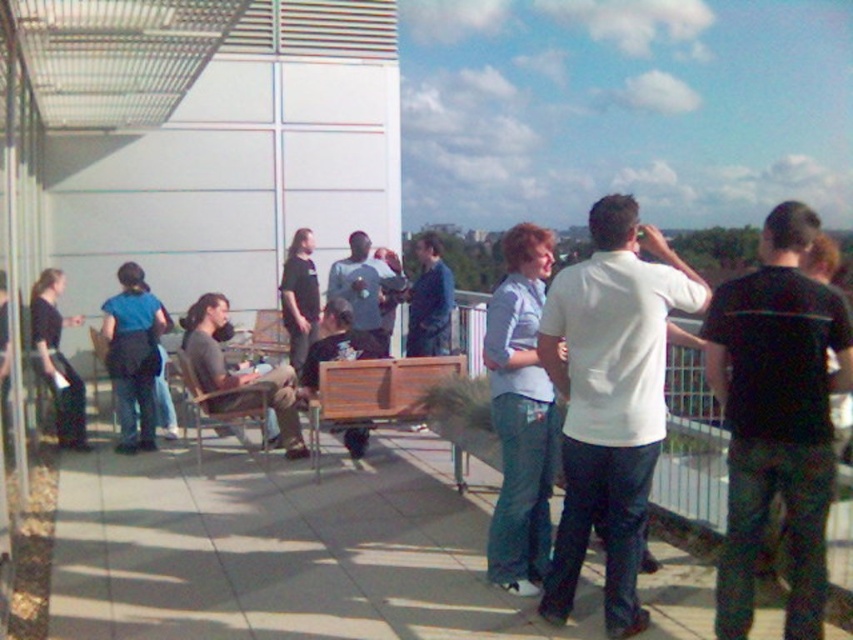
Question: Is white matte shirt at center smaller than brown wooden bench at center?

Choices:
 (A) yes
 (B) no

Answer: (A)

Question: Estimate the real-world distances between objects in this image. Which object is farther from the white matte shirt at center?

Choices:
 (A) wooden bench at center
 (B) blue denim jacket at center
 (C) gray fabric shirt at center

Answer: (B)

Question: Which point is farther to the camera?

Choices:
 (A) (440, 317)
 (B) (260, 397)
 (C) (381, 269)
 (D) (822, 547)

Answer: (C)

Question: Which object is positioned farthest from the wooden bench at center?

Choices:
 (A) white matte shirt at center
 (B) black cotton shirt at right
 (C) blue denim jacket at center
 (D) brown wooden bench at center

Answer: (B)

Question: Does black cotton shirt at right appear under blue denim jacket at center?

Choices:
 (A) yes
 (B) no

Answer: (A)

Question: Observing the image, what is the correct spatial positioning of gray fabric shirt at center in reference to brown wooden bench at center?

Choices:
 (A) left
 (B) right

Answer: (B)